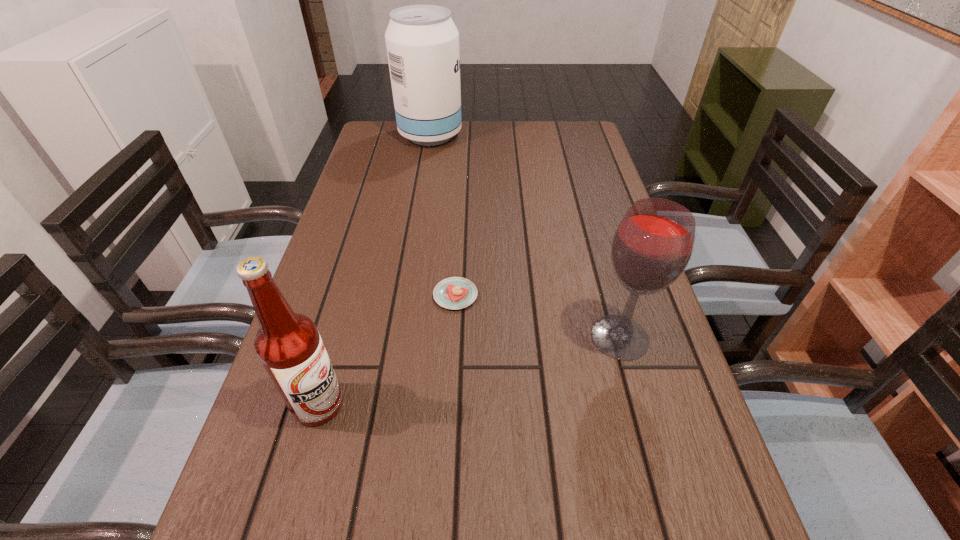
The width and height of the screenshot is (960, 540). I want to click on vacant space that is in between the pastry and the farthest object, so click(x=443, y=215).

Where is `free space between the rightmost alcohol and the nearest object`? The height and width of the screenshot is (540, 960). free space between the rightmost alcohol and the nearest object is located at coordinates (469, 370).

You are a GUI agent. You are given a task and a screenshot of the screen. Output one action in this format:
    pyautogui.click(x=<x>, y=<y>)
    Task: Click on the vacant area that lies between the farthest object and the nearest alcohol
    The width and height of the screenshot is (960, 540).
    Given the screenshot: What is the action you would take?
    pyautogui.click(x=374, y=269)

Find the location of `unoccupied area between the farthest alcohol and the nearest object`. unoccupied area between the farthest alcohol and the nearest object is located at coordinates (374, 269).

Find the location of a particular element. The width and height of the screenshot is (960, 540). vacant region between the second nearest object and the third nearest object is located at coordinates (538, 316).

The image size is (960, 540). I want to click on vacant space that's between the rightmost alcohol and the nearest alcohol, so click(x=469, y=370).

Image resolution: width=960 pixels, height=540 pixels. What are the coordinates of `object that is the third closest one to the nearest alcohol` in the screenshot? It's located at (422, 41).

Image resolution: width=960 pixels, height=540 pixels. I want to click on object that is the closest to the second nearest object, so click(x=455, y=292).

Find the location of a particular element. This screenshot has width=960, height=540. alcohol that is the closest to the farthest object is located at coordinates (651, 248).

Where is `alcohol that is the closest one to the third farthest object`? The height and width of the screenshot is (540, 960). alcohol that is the closest one to the third farthest object is located at coordinates (288, 344).